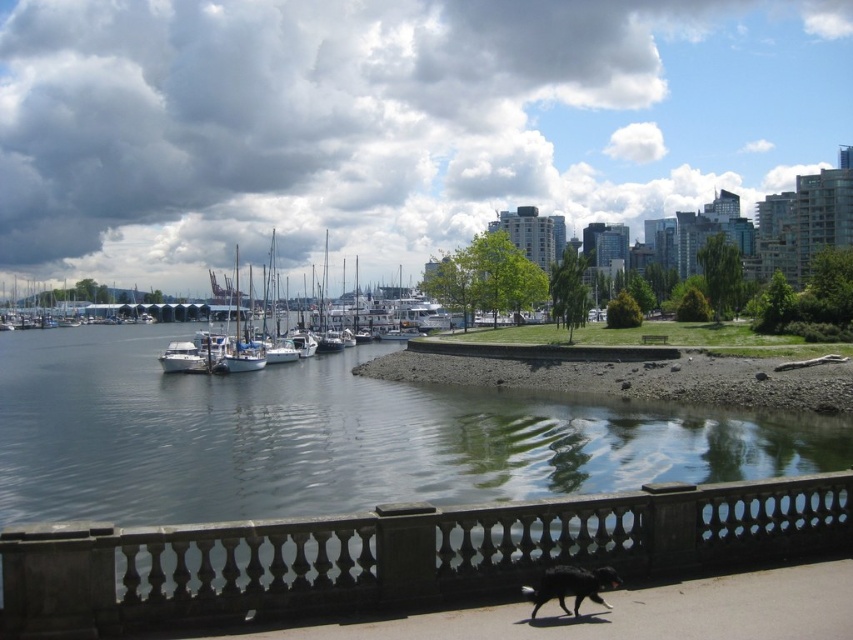
Question: Is dark gray stone railing at lower center bigger than white matte boats at center?

Choices:
 (A) yes
 (B) no

Answer: (B)

Question: Among these objects, which one is nearest to the camera?

Choices:
 (A) white matte boats at center
 (B) black fur dog at lower center
 (C) dark gray stone railing at lower center

Answer: (B)

Question: Can you confirm if dark gray stone railing at lower center is positioned above white matte boats at center?

Choices:
 (A) yes
 (B) no

Answer: (B)

Question: Which of the following is the farthest from the observer?

Choices:
 (A) dark gray stone railing at lower center
 (B) black fur dog at lower center

Answer: (A)

Question: Does dark gray stone railing at lower center have a lesser width compared to black fur dog at lower center?

Choices:
 (A) yes
 (B) no

Answer: (A)

Question: Which point is closer to the camera taking this photo?

Choices:
 (A) (251, 353)
 (B) (703, 500)

Answer: (B)